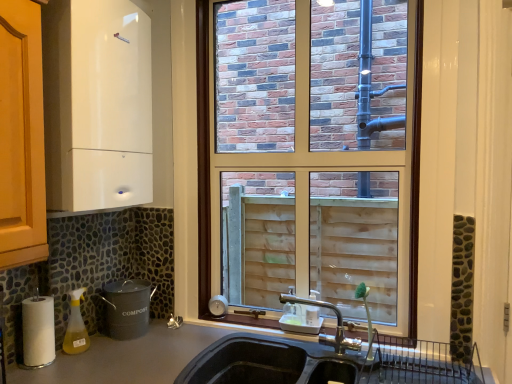
Question: Does white paper towel at lower left, placed as the second appliance when sorted from bottom to top, have a lesser height compared to smooth gray countertop at lower left?

Choices:
 (A) yes
 (B) no

Answer: (A)

Question: From the image's perspective, is white paper towel at lower left, placed as the second appliance when sorted from bottom to top, under smooth gray countertop at lower left?

Choices:
 (A) no
 (B) yes

Answer: (A)

Question: Is white paper towel at lower left, arranged as the second appliance when viewed from the top, looking in the opposite direction of smooth gray countertop at lower left?

Choices:
 (A) yes
 (B) no

Answer: (B)

Question: Considering the relative sizes of white paper towel at lower left, arranged as the second appliance when viewed from the top, and smooth gray countertop at lower left in the image provided, is white paper towel at lower left, arranged as the second appliance when viewed from the top, wider than smooth gray countertop at lower left?

Choices:
 (A) yes
 (B) no

Answer: (B)

Question: From a real-world perspective, is white paper towel at lower left, placed as the second appliance when sorted from bottom to top, on top of smooth gray countertop at lower left?

Choices:
 (A) yes
 (B) no

Answer: (A)

Question: Can you confirm if white paper towel at lower left, arranged as the second appliance when viewed from the top, is smaller than smooth gray countertop at lower left?

Choices:
 (A) no
 (B) yes

Answer: (B)

Question: Is the depth of yellow translucent spray bottle at lower left less than that of smooth gray countertop at lower left?

Choices:
 (A) yes
 (B) no

Answer: (B)

Question: Considering the relative sizes of yellow translucent spray bottle at lower left and smooth gray countertop at lower left in the image provided, is yellow translucent spray bottle at lower left bigger than smooth gray countertop at lower left?

Choices:
 (A) yes
 (B) no

Answer: (B)

Question: Does yellow translucent spray bottle at lower left have a greater height compared to smooth gray countertop at lower left?

Choices:
 (A) yes
 (B) no

Answer: (B)

Question: Is yellow translucent spray bottle at lower left further to the viewer compared to smooth gray countertop at lower left?

Choices:
 (A) no
 (B) yes

Answer: (B)

Question: Can you confirm if yellow translucent spray bottle at lower left is positioned to the left of smooth gray countertop at lower left?

Choices:
 (A) yes
 (B) no

Answer: (A)

Question: From the image's perspective, would you say yellow translucent spray bottle at lower left is positioned over smooth gray countertop at lower left?

Choices:
 (A) yes
 (B) no

Answer: (A)

Question: Is smooth gray countertop at lower left outside white glossy boiler at upper left, marked as the 3th appliance in a bottom-to-top arrangement?

Choices:
 (A) no
 (B) yes

Answer: (B)